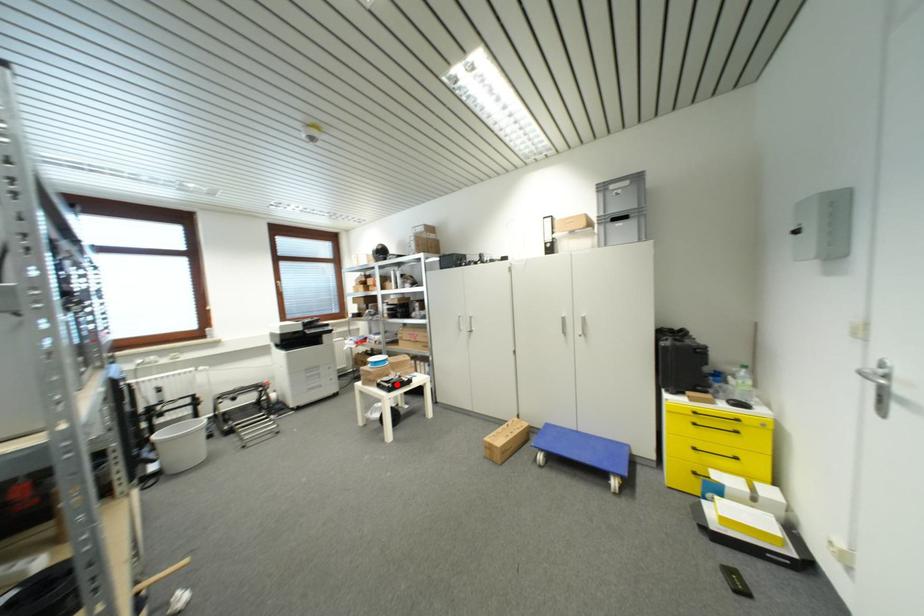
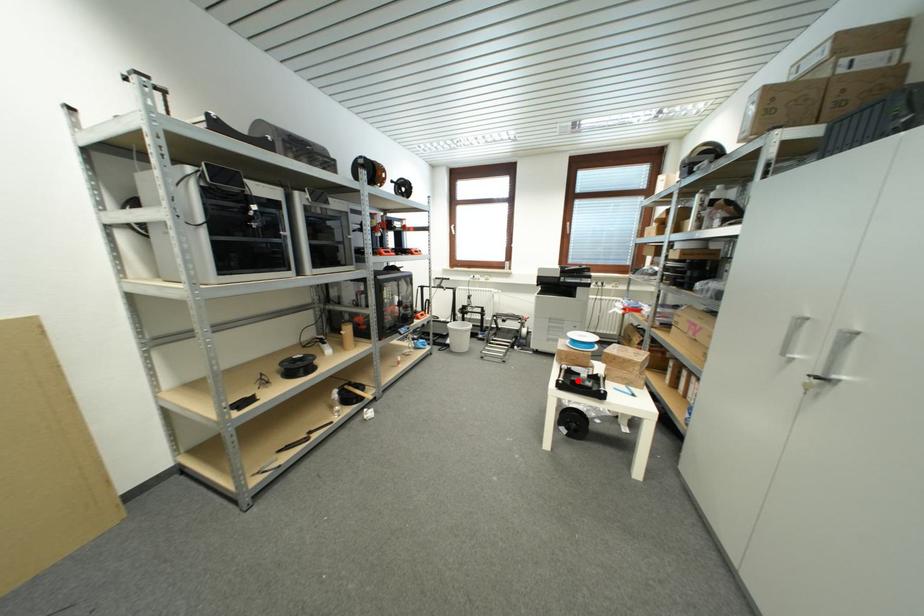
I am providing you with two images of the same scene from different viewpoints. A red point is marked on the first image and another point is marked on the second image. Do the highlighted points in image1 and image2 indicate the same real-world spot?

Yes